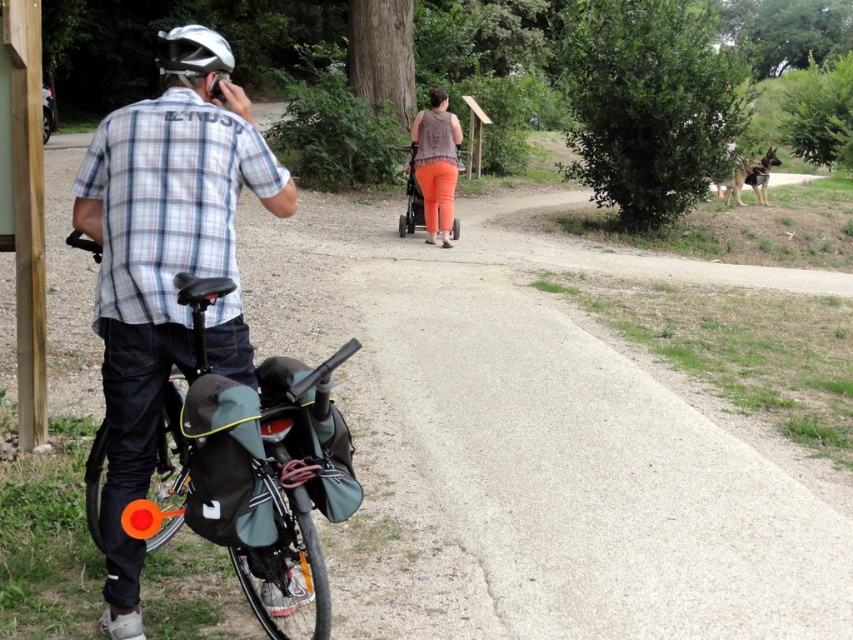
Question: Which of the following is the closest to the observer?

Choices:
 (A) (177, 51)
 (B) (419, 225)
 (C) (277, 163)
 (D) (440, 116)

Answer: (A)

Question: Does orange cotton pants at center appear on the right side of silver metallic helmet at upper left?

Choices:
 (A) yes
 (B) no

Answer: (A)

Question: Which point is closer to the camera?

Choices:
 (A) [160, 211]
 (B) [157, 35]

Answer: (A)

Question: Which of the following is the farthest from the observer?

Choices:
 (A) matte plaid shirt at left
 (B) silver metallic helmet at upper left

Answer: (B)

Question: Does matte plaid shirt at left appear on the right side of orange cotton pants at center?

Choices:
 (A) yes
 (B) no

Answer: (B)

Question: Is matte plaid shirt at left smaller than orange cotton pants at center?

Choices:
 (A) no
 (B) yes

Answer: (B)